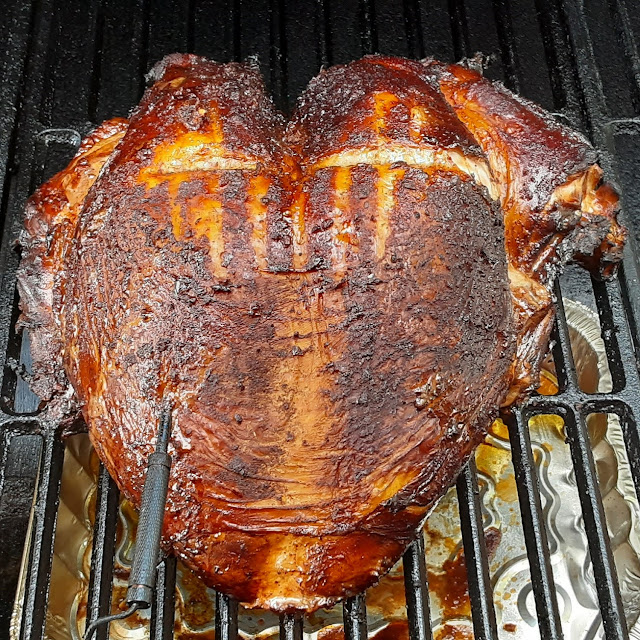
The height and width of the screenshot is (640, 640). In order to click on aluminum pan in this screenshot , I will do `click(559, 508)`.